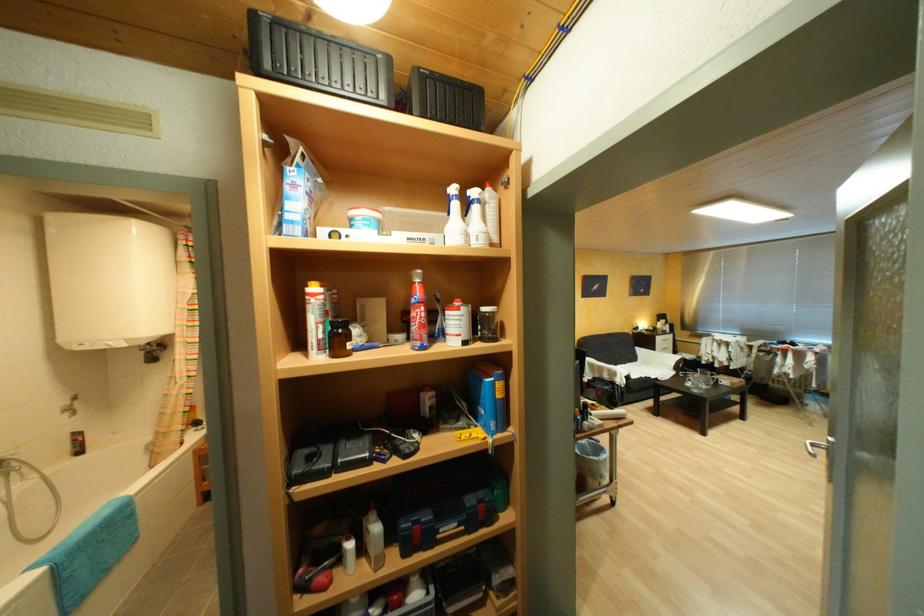
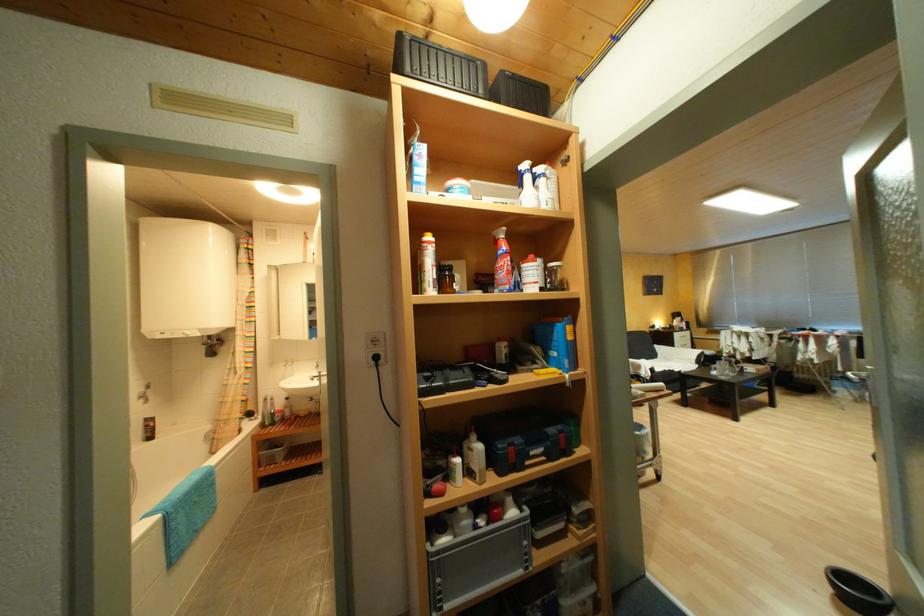
The point at (641, 378) is marked in the first image. Where is the corresponding point in the second image?

(666, 371)